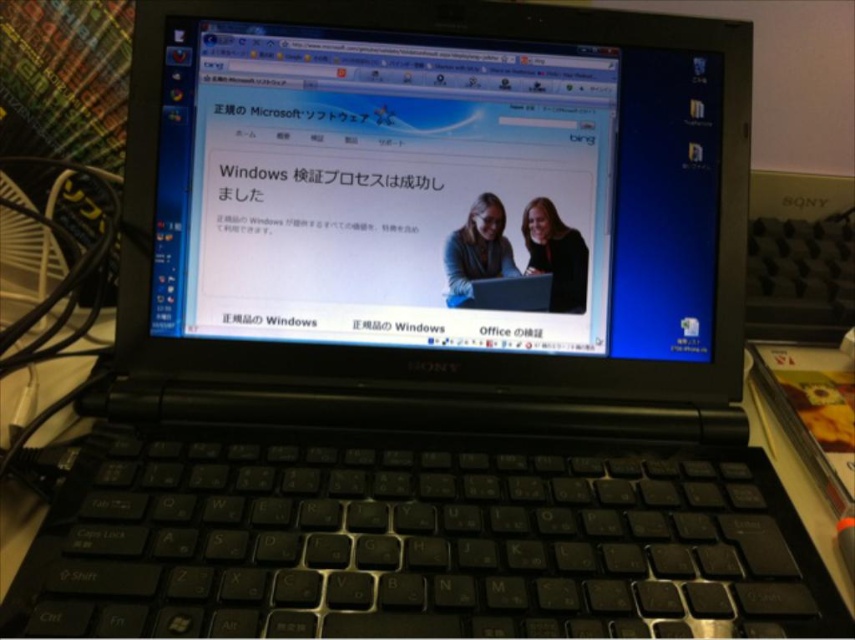
Which is behind, point (258, 161) or point (131, 424)?

Positioned behind is point (258, 161).

Does matte black laptop at center appear on the right side of black matte keyboard at center?

Yes, matte black laptop at center is to the right of black matte keyboard at center.

Is point (282, 179) positioned before point (392, 573)?

No, (282, 179) is further to viewer.

Locate an element on the screen. matte black laptop at center is located at coordinates (435, 189).